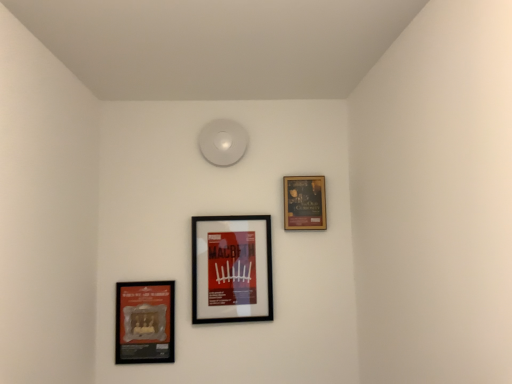
Question: From a real-world perspective, is black matte picture frame at center, the 2th picture frame from the left, above or below matte black picture frame at lower left, positioned as the 3th picture frame in right-to-left order?

Choices:
 (A) above
 (B) below

Answer: (A)

Question: From the image's perspective, is black matte picture frame at center, the second picture frame from the right, positioned above or below matte black picture frame at lower left, positioned as the 3th picture frame in right-to-left order?

Choices:
 (A) below
 (B) above

Answer: (B)

Question: Based on their relative distances, which object is farther from the matte black picture frame at lower left, positioned as the 3th picture frame in right-to-left order?

Choices:
 (A) wooden frame at upper right, marked as the third picture frame in a left-to-right arrangement
 (B) black matte picture frame at center, the 2th picture frame from the left

Answer: (A)

Question: Which is farther from the black matte picture frame at center, the 2th picture frame from the left?

Choices:
 (A) wooden frame at upper right, marked as the third picture frame in a left-to-right arrangement
 (B) matte black picture frame at lower left, positioned as the 3th picture frame in right-to-left order

Answer: (A)